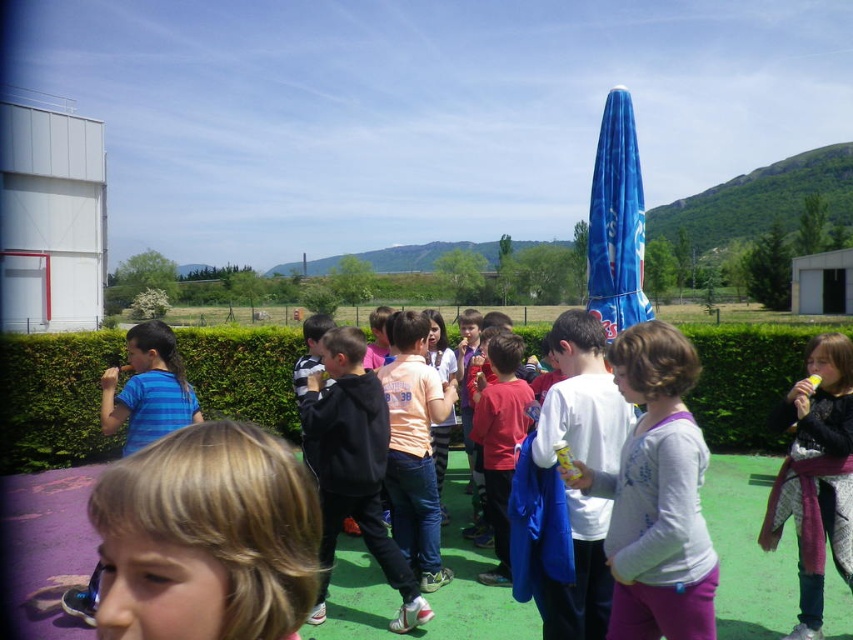
You are a photographer trying to capture a photo of the white matte shirt at center and the green hedge at center. According to the scene, which object is positioned to the left of the other?

The green hedge at center is to the left of the white matte shirt at center.

You are a photographer standing at the edge of the field. You want to take a photo that includes both the black matte jacket at center and the orange cotton shirt at center. What is the minimum distance you need to step back to ensure both are fully visible in the frame?

The minimum distance you need to step back is 17.71 inches to ensure both the black matte jacket at center and the orange cotton shirt at center are fully visible in the frame.